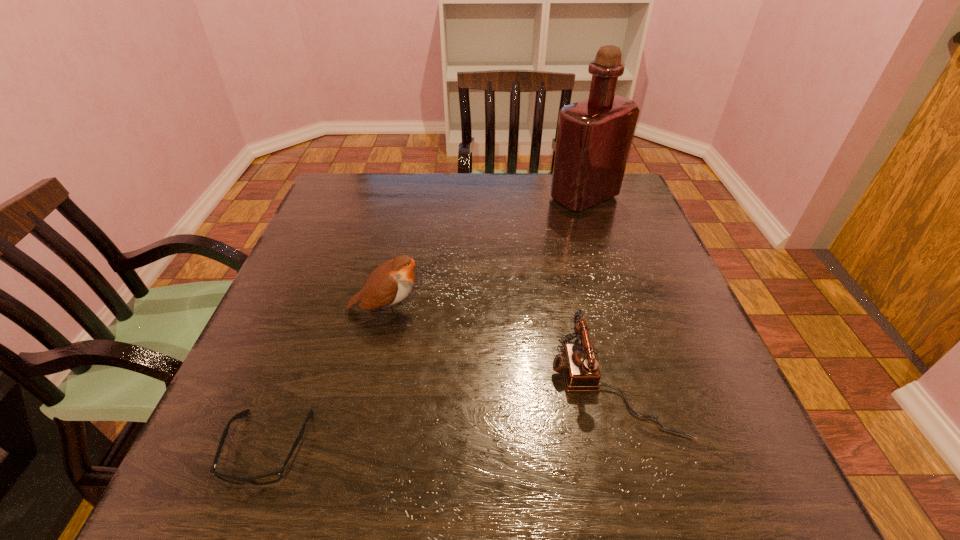
This screenshot has height=540, width=960. In order to click on free space between the second shortest object and the shortest object in this screenshot , I will do `click(441, 416)`.

The width and height of the screenshot is (960, 540). In order to click on free space between the shortest object and the second shortest object in this screenshot , I will do `click(441, 416)`.

Identify the location of unoccupied position between the spectacles and the second farthest object. (327, 379).

Where is `free space between the spectacles and the second shortest object`? Image resolution: width=960 pixels, height=540 pixels. free space between the spectacles and the second shortest object is located at coordinates (441, 416).

Identify which object is the nearest to the bird. Please provide its 2D coordinates. Your answer should be formatted as a tuple, i.e. [(x, y)], where the tuple contains the x and y coordinates of a point satisfying the conditions above.

[(270, 478)]

Where is `the closest object relative to the second shortest object`? This screenshot has width=960, height=540. the closest object relative to the second shortest object is located at coordinates (390, 283).

Find the location of a particular element. The width and height of the screenshot is (960, 540). vacant space that satisfies the following two spatial constraints: 1. at the face of the third shortest object; 2. on the front-facing side of the shortest object is located at coordinates (357, 448).

Identify the location of vacant space that satisfies the following two spatial constraints: 1. on the front side of the farthest object; 2. on the dial of the telephone. (645, 384).

This screenshot has width=960, height=540. I want to click on vacant space that satisfies the following two spatial constraints: 1. on the dial of the telephone; 2. on the front-facing side of the spectacles, so click(631, 448).

The image size is (960, 540). Identify the location of vacant area that satisfies the following two spatial constraints: 1. on the dial of the telephone; 2. on the front-facing side of the shortest object. (631, 448).